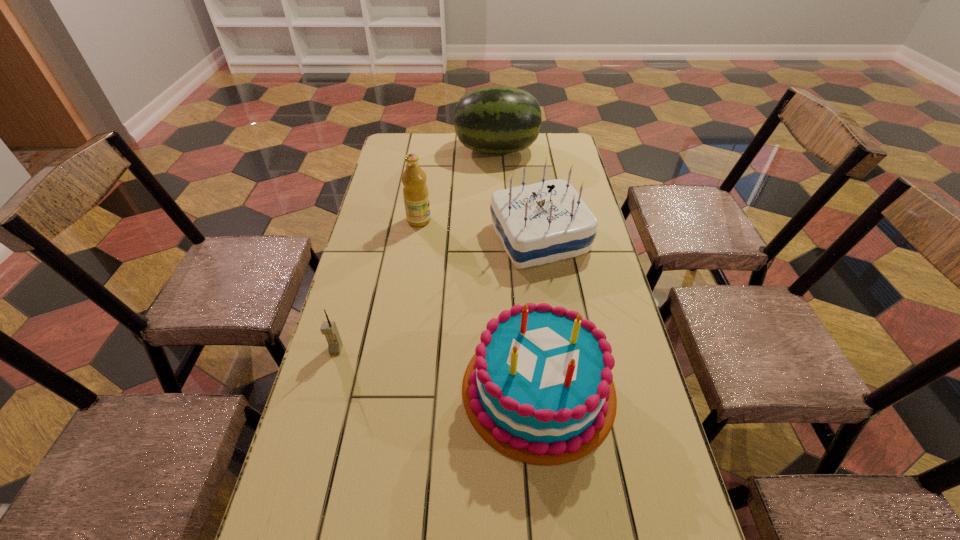
You are a GUI agent. You are given a task and a screenshot of the screen. Output one action in this format:
    pyautogui.click(x=<x>, y=<y>)
    Task: Click on the free space at the far right corner of the desktop
    This screenshot has height=540, width=960.
    Given the screenshot: What is the action you would take?
    pyautogui.click(x=557, y=137)

At what (x,y) coordinates should I click in order to perform the action: click on blank region between the cellular telephone and the olive oil. Please return your answer as a coordinate pair (x, y). This screenshot has height=540, width=960. Looking at the image, I should click on (377, 285).

The width and height of the screenshot is (960, 540). What are the coordinates of `free space that is in between the farther birthday cake and the cellular telephone` in the screenshot? It's located at (438, 293).

Identify the location of vacant area that lies between the farthest object and the second object from left to right. This screenshot has height=540, width=960. (458, 185).

The height and width of the screenshot is (540, 960). I want to click on free spot between the farther birthday cake and the cellular telephone, so click(x=438, y=293).

Find the location of `vacant space that is in between the fourth object from right to left and the shortest object`. vacant space that is in between the fourth object from right to left and the shortest object is located at coordinates (377, 285).

Locate an element on the screen. vacant space that is in between the farther birthday cake and the olive oil is located at coordinates (479, 229).

Identify the location of empty location between the nearer birthday cake and the leftmost object. The height and width of the screenshot is (540, 960). (438, 369).

The image size is (960, 540). Identify the location of free space between the nearer birthday cake and the shortest object. (438, 369).

Choose which object is the third nearest neighbor to the nearer birthday cake. Please provide its 2D coordinates. Your answer should be formatted as a tuple, i.e. [(x, y)], where the tuple contains the x and y coordinates of a point satisfying the conditions above.

[(415, 191)]